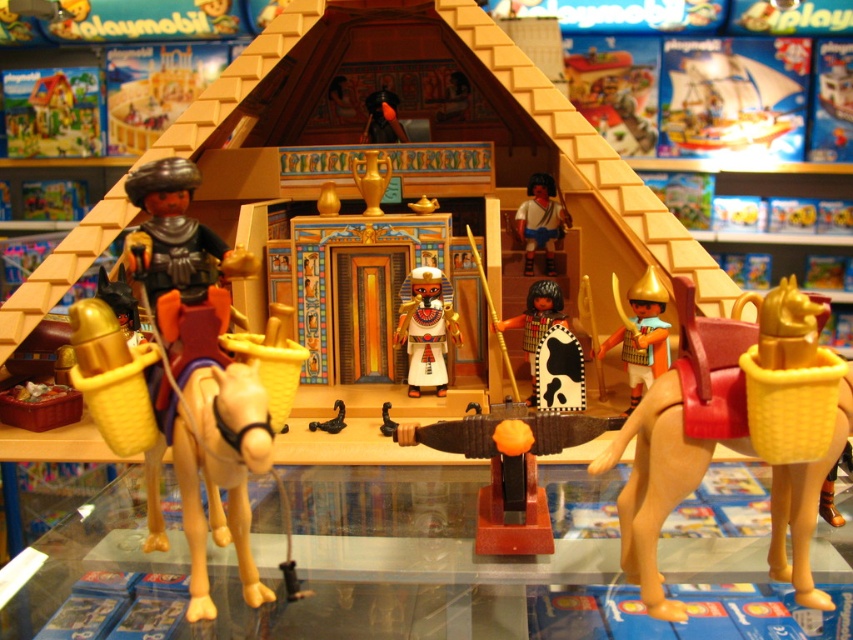
You are a Playmobil figure trying to fit through a narrow doorway in the pyramid. The doorway is exactly the width of the matte gold pharaoh at center. Can you also fit the gold metallic helmet at right through the same doorway?

The matte gold pharaoh at center is narrower than the gold metallic helmet at right. Since the doorway is exactly the width of the matte gold pharaoh at center, the gold metallic helmet at right would not fit through the same doorway because it is wider.

What are the exact coordinates of the matte gold pharaoh at center in the image?

The matte gold pharaoh at center is located at point coordinates of (426, 326).